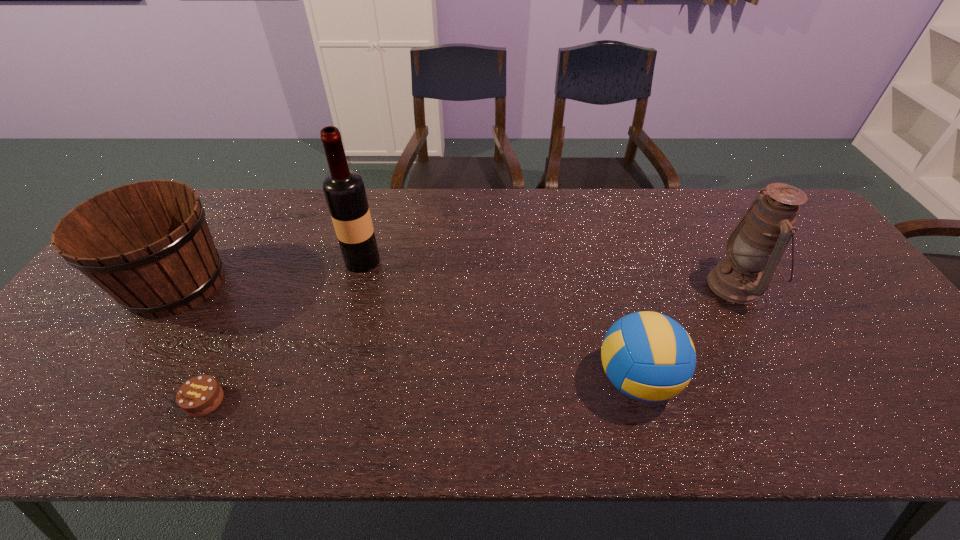
In the image, there is a desktop. At what (x,y) coordinates should I click in order to perform the action: click on vacant space at the left edge. Please return your answer as a coordinate pair (x, y). This screenshot has height=540, width=960. Looking at the image, I should click on (74, 354).

Identify the location of free space at the near right corner of the desktop. The width and height of the screenshot is (960, 540). (940, 434).

Identify the location of vacant region between the fourth object from left to right and the wine bucket. The width and height of the screenshot is (960, 540). (406, 332).

This screenshot has width=960, height=540. What are the coordinates of `free space between the second tallest object and the third shortest object` in the screenshot? It's located at (456, 285).

You are a GUI agent. You are given a task and a screenshot of the screen. Output one action in this format:
    pyautogui.click(x=<x>, y=<y>)
    Task: Click on the free space between the tallest object and the fourth object from left to right
    
    Given the screenshot: What is the action you would take?
    pyautogui.click(x=499, y=320)

You are a GUI agent. You are given a task and a screenshot of the screen. Output one action in this format:
    pyautogui.click(x=<x>, y=<y>)
    Task: Click on the vacant region between the wine bucket and the shortest object
    The image size is (960, 540).
    Given the screenshot: What is the action you would take?
    pyautogui.click(x=190, y=342)

The height and width of the screenshot is (540, 960). What are the coordinates of `free spot between the third tallest object and the second tallest object` in the screenshot? It's located at (456, 285).

The width and height of the screenshot is (960, 540). I want to click on free space between the third shortest object and the third object from left to right, so (269, 272).

Identify the location of vacant region between the second tallest object and the wine bucket. (456, 285).

Locate an element on the screen. The width and height of the screenshot is (960, 540). vacant point located between the rightmost object and the chocolate cake is located at coordinates (470, 343).